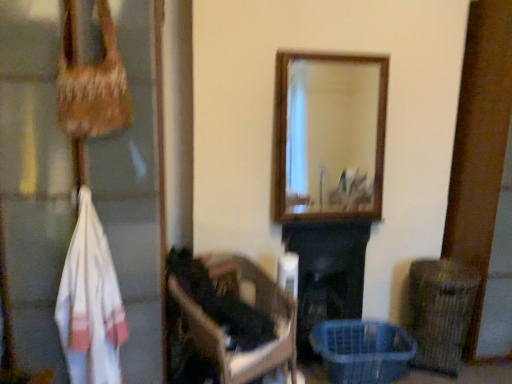
Question: Can you confirm if dark brown wooden chair at center is shorter than translucent plastic basket at lower right?

Choices:
 (A) yes
 (B) no

Answer: (B)

Question: From a real-world perspective, is dark brown wooden chair at center positioned under translucent plastic basket at lower right based on gravity?

Choices:
 (A) no
 (B) yes

Answer: (A)

Question: Is dark brown wooden chair at center facing towards translucent plastic basket at lower right?

Choices:
 (A) yes
 (B) no

Answer: (B)

Question: Can we say dark brown wooden chair at center lies outside translucent plastic basket at lower right?

Choices:
 (A) yes
 (B) no

Answer: (A)

Question: Is dark brown wooden chair at center positioned before translucent plastic basket at lower right?

Choices:
 (A) no
 (B) yes

Answer: (B)

Question: Choose the correct answer: Is black matte fireplace at center inside white woven bag at left or outside it?

Choices:
 (A) outside
 (B) inside

Answer: (A)

Question: Considering the positions of point (360, 288) and point (66, 157), is point (360, 288) closer or farther from the camera than point (66, 157)?

Choices:
 (A) farther
 (B) closer

Answer: (A)

Question: From the image's perspective, is black matte fireplace at center above or below white woven bag at left?

Choices:
 (A) below
 (B) above

Answer: (A)

Question: Is black matte fireplace at center taller or shorter than white woven bag at left?

Choices:
 (A) tall
 (B) short

Answer: (B)

Question: Considering their positions, is black matte fireplace at center located in front of or behind white woven towel at left?

Choices:
 (A) behind
 (B) front

Answer: (A)

Question: From the image's perspective, is black matte fireplace at center positioned above or below white woven towel at left?

Choices:
 (A) below
 (B) above

Answer: (A)

Question: Is black matte fireplace at center wider or thinner than white woven towel at left?

Choices:
 (A) wide
 (B) thin

Answer: (A)

Question: From a real-world perspective, relative to white woven towel at left, is black matte fireplace at center vertically above or below?

Choices:
 (A) above
 (B) below

Answer: (B)

Question: Is point (148, 77) closer or farther from the camera than point (83, 345)?

Choices:
 (A) closer
 (B) farther

Answer: (A)

Question: Is white woven bag at left in front of or behind white woven towel at left in the image?

Choices:
 (A) front
 (B) behind

Answer: (A)